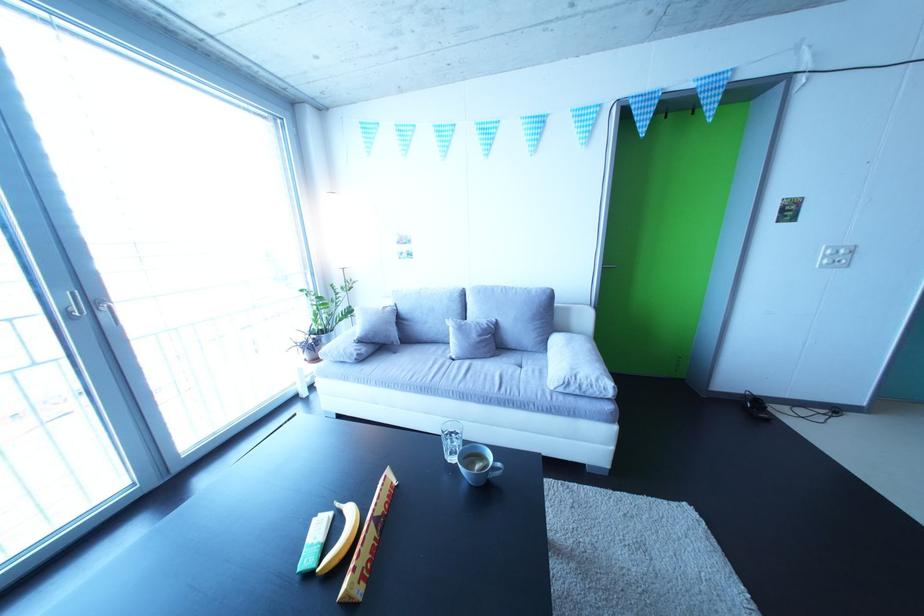
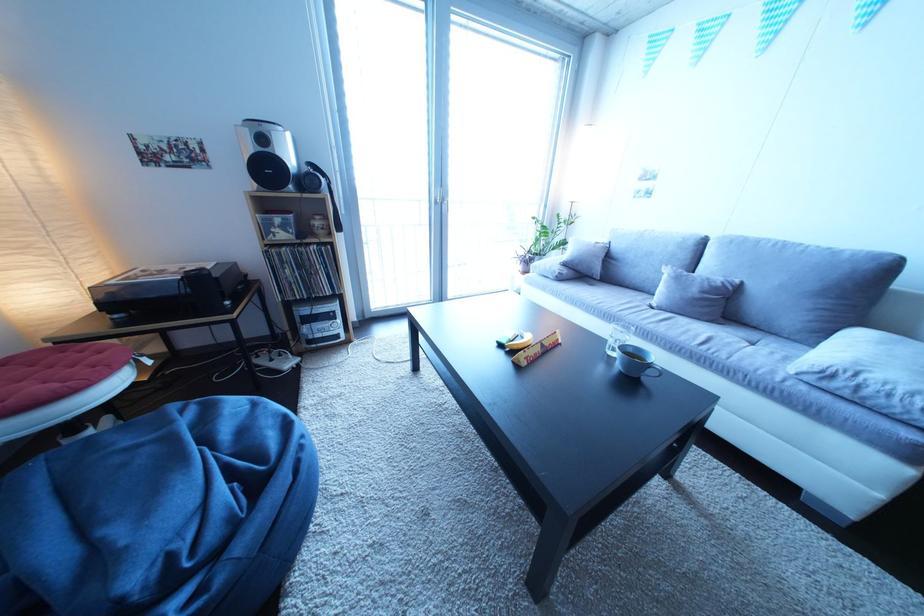
In the second image, find the point that corresponds to point (365, 361) in the first image.

(567, 278)